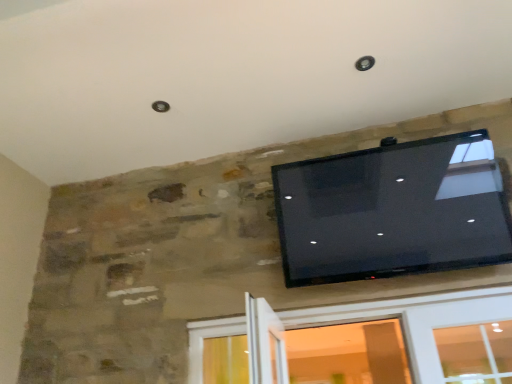
What is the approximate height of metallic circular hole at upper center?

metallic circular hole at upper center is 1.00 inches tall.

This screenshot has height=384, width=512. Describe the element at coordinates (364, 63) in the screenshot. I see `metallic circular hole at upper center` at that location.

Where is `metallic circular hole at upper center`? The width and height of the screenshot is (512, 384). metallic circular hole at upper center is located at coordinates (364, 63).

The image size is (512, 384). What are the coordinates of `metallic circular hole at upper center` in the screenshot? It's located at (364, 63).